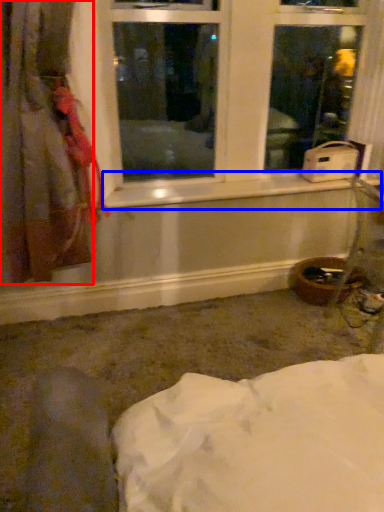
Question: Which point is closer to the camera, curtain (highlighted by a red box) or window sill (highlighted by a blue box)?

Choices:
 (A) curtain
 (B) window sill

Answer: (A)